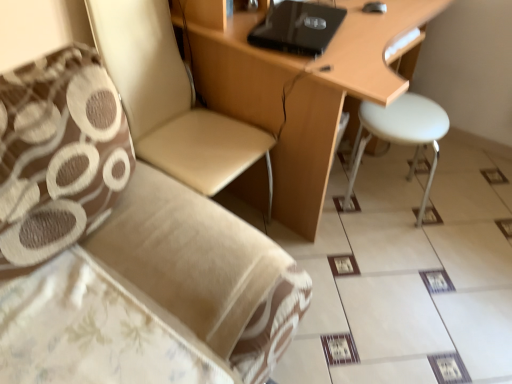
Where is `blank space to the left of white plastic stool at right`? This screenshot has height=384, width=512. blank space to the left of white plastic stool at right is located at coordinates (325, 216).